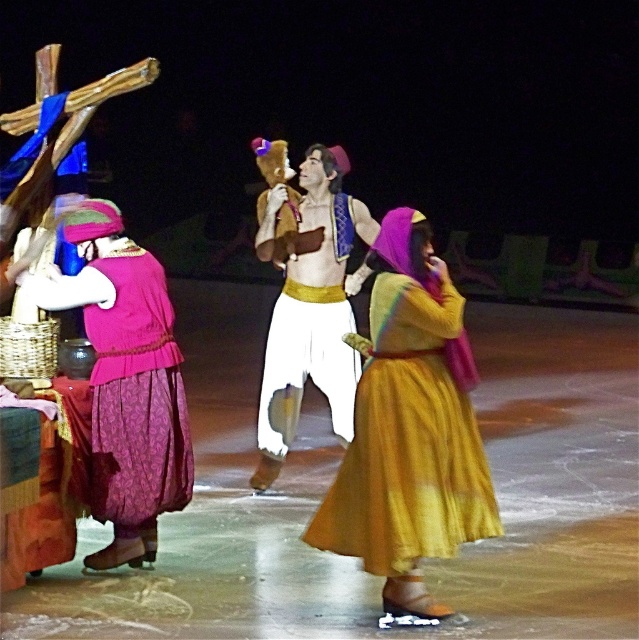
Which is below, white satin pants at center or purple satin dress at left?

purple satin dress at left

Measure the distance between white satin pants at center and purple satin dress at left.

1.47 meters

Where is `white satin pants at center`? white satin pants at center is located at coordinates (309, 307).

In the scene shown: Is yellow satin dress at center smaller than purple satin dress at left?

No, yellow satin dress at center is not smaller than purple satin dress at left.

Consider the image. Who is more distant from viewer, (449, 426) or (142, 380)?

Point (142, 380)

Locate an element on the screen. The image size is (639, 640). yellow satin dress at center is located at coordinates (410, 428).

Does yellow satin dress at center lie behind white satin pants at center?

No, it is in front of white satin pants at center.

Does yellow satin dress at center appear on the right side of white satin pants at center?

Indeed, yellow satin dress at center is positioned on the right side of white satin pants at center.

Measure the distance between point (387,396) and camera.

14.69 feet

Locate an element on the screen. yellow satin dress at center is located at coordinates (410, 428).